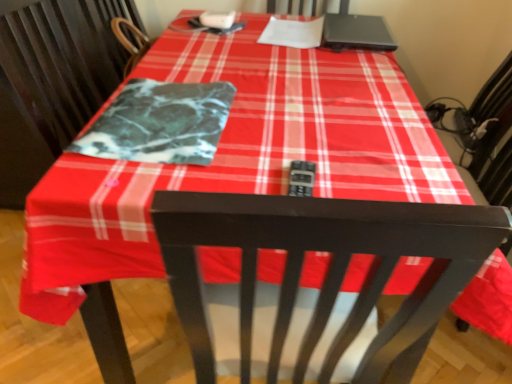
Question: Is marble-like fabric at center taller than black matte laptop at upper right?

Choices:
 (A) no
 (B) yes

Answer: (A)

Question: From the image's perspective, does marble-like fabric at center appear higher than black matte laptop at upper right?

Choices:
 (A) yes
 (B) no

Answer: (B)

Question: From a real-world perspective, is marble-like fabric at center beneath black matte laptop at upper right?

Choices:
 (A) yes
 (B) no

Answer: (A)

Question: From the image's perspective, is marble-like fabric at center located beneath black matte laptop at upper right?

Choices:
 (A) no
 (B) yes

Answer: (B)

Question: From a real-world perspective, does marble-like fabric at center stand above black matte laptop at upper right?

Choices:
 (A) no
 (B) yes

Answer: (A)

Question: Can you confirm if marble-like fabric at center is positioned to the left of black matte laptop at upper right?

Choices:
 (A) yes
 (B) no

Answer: (A)

Question: Is black matte laptop at upper right behind marble-like fabric at center?

Choices:
 (A) no
 (B) yes

Answer: (B)

Question: Does black matte laptop at upper right have a lesser width compared to marble-like fabric at center?

Choices:
 (A) no
 (B) yes

Answer: (A)

Question: Is black matte laptop at upper right oriented towards marble-like fabric at center?

Choices:
 (A) yes
 (B) no

Answer: (B)

Question: Would you say marble-like fabric at center is part of black matte laptop at upper right's contents?

Choices:
 (A) no
 (B) yes

Answer: (A)

Question: From a real-world perspective, is black matte laptop at upper right over marble-like fabric at center?

Choices:
 (A) no
 (B) yes

Answer: (B)

Question: Is black matte laptop at upper right in contact with marble-like fabric at center?

Choices:
 (A) yes
 (B) no

Answer: (B)

Question: Looking at the image, does marble-like fabric at center seem bigger or smaller compared to black matte laptop at upper right?

Choices:
 (A) big
 (B) small

Answer: (B)